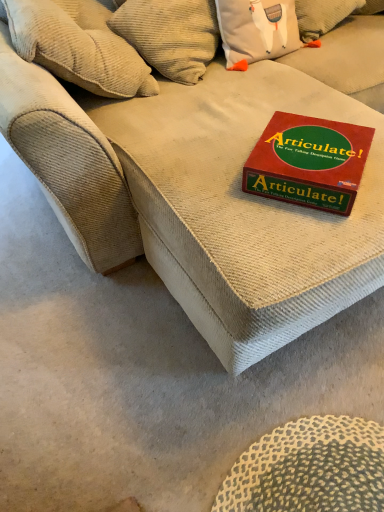
Question: Is red cardboard game box at center bigger or smaller than beige corduroy couch at center?

Choices:
 (A) small
 (B) big

Answer: (A)

Question: Is red cardboard game box at center taller or shorter than beige corduroy couch at center?

Choices:
 (A) tall
 (B) short

Answer: (B)

Question: Which of these objects is positioned closest to the beige corduroy pillow at upper left?

Choices:
 (A) red cardboard game box at center
 (B) beige corduroy couch at center

Answer: (B)

Question: Estimate the real-world distances between objects in this image. Which object is farther from the beige corduroy couch at center?

Choices:
 (A) beige corduroy pillow at upper left
 (B) red cardboard game box at center

Answer: (A)